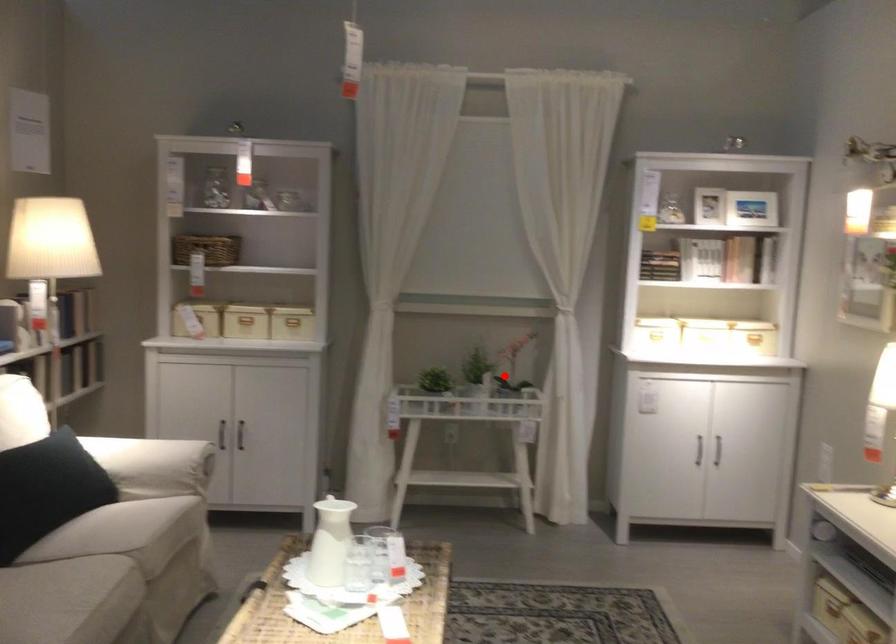
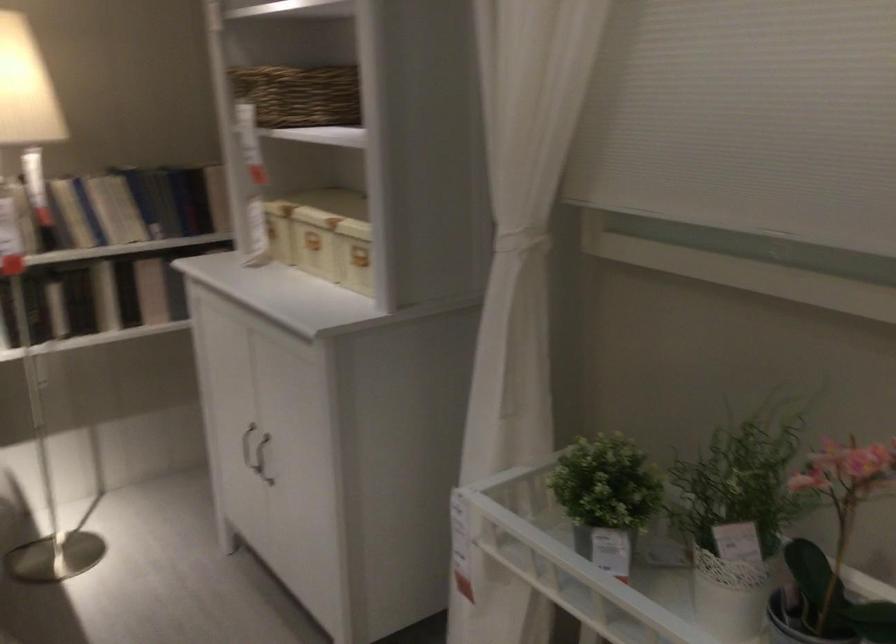
Question: I am providing you with two images of the same scene from different viewpoints. Given a red point in image1, look at the same physical point in image2. Is it:

Choices:
 (A) Closer to the viewpoint
 (B) Farther from the viewpoint

Answer: (A)